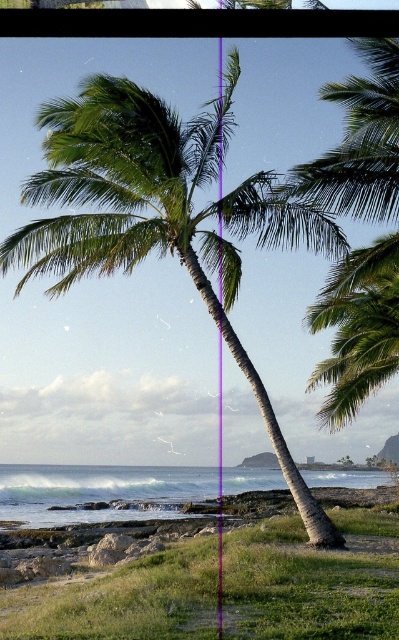
Question: Is green leafy coconut tree at center positioned in front of clear water at lower center?

Choices:
 (A) no
 (B) yes

Answer: (B)

Question: Can you confirm if green leafy coconut tree at center is positioned above clear water at lower center?

Choices:
 (A) no
 (B) yes

Answer: (B)

Question: Among these objects, which one is nearest to the camera?

Choices:
 (A) clear water at lower center
 (B) green leafy coconut tree at center

Answer: (B)

Question: Where is green leafy coconut tree at center located in relation to clear water at lower center in the image?

Choices:
 (A) left
 (B) right

Answer: (A)